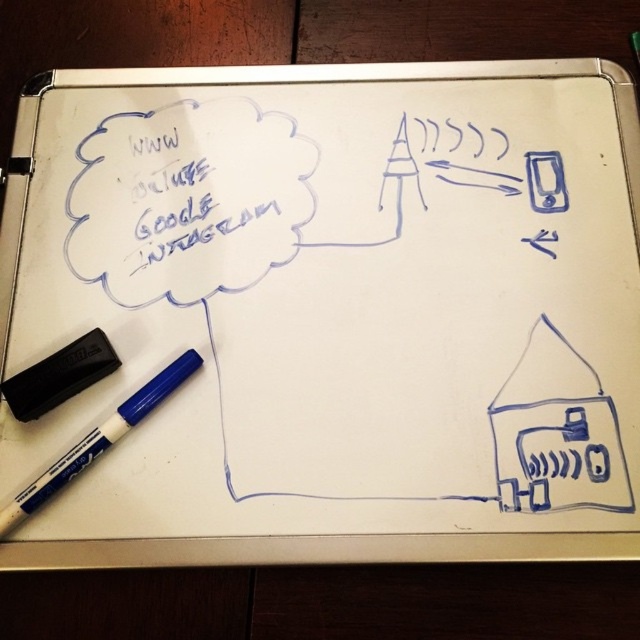
Does blue handwritten text at upper left have a lesser height compared to white matte marker at bottom left?

No.

Which is behind, point (198, 192) or point (96, 428)?

The point (198, 192) is behind.

Find the location of `blue handwritten text at upper left`. blue handwritten text at upper left is located at coordinates (212, 205).